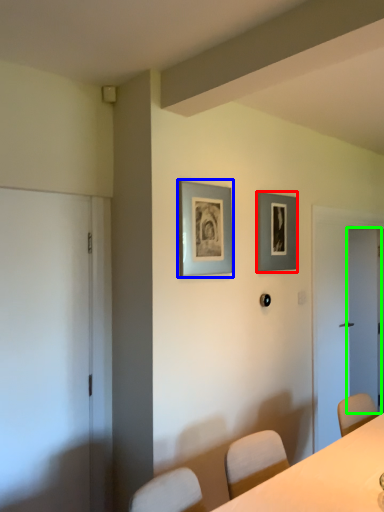
Question: Which object is positioned closest to picture frame (highlighted by a red box)? Select from picture frame (highlighted by a blue box) and door (highlighted by a green box).

Choices:
 (A) picture frame
 (B) door

Answer: (A)